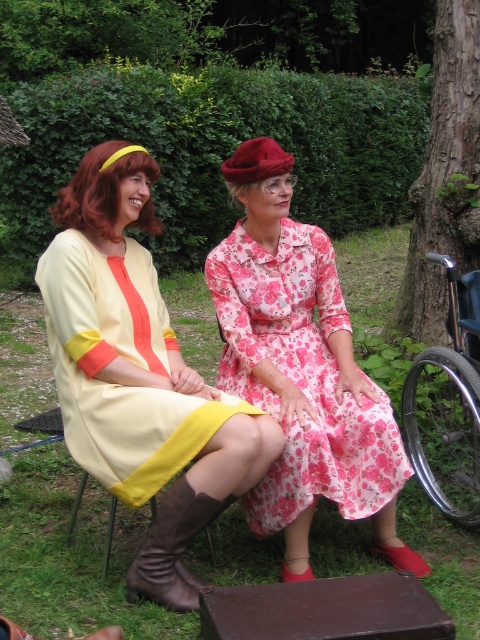
You are a tailor who needs to determine which item requires more fabric to alter. You see the pink floral fabric dress at center and the yellow fabric stool at lower left. Which one would need more fabric for alterations?

The pink floral fabric dress at center is bigger than the yellow fabric stool at lower left, so it would require more fabric for alterations.

You are designing a photo shoot and need to ensure that the matte yellow dress at center and the yellow fabric stool at lower left are both visible in the frame. Based on their sizes, which object should you focus on to ensure both are in the shot?

The matte yellow dress at center is larger in size than the yellow fabric stool at lower left, so you should focus on the matte yellow dress at center to ensure both are visible in the frame since it takes up more space and the stool can be positioned within the same shot.